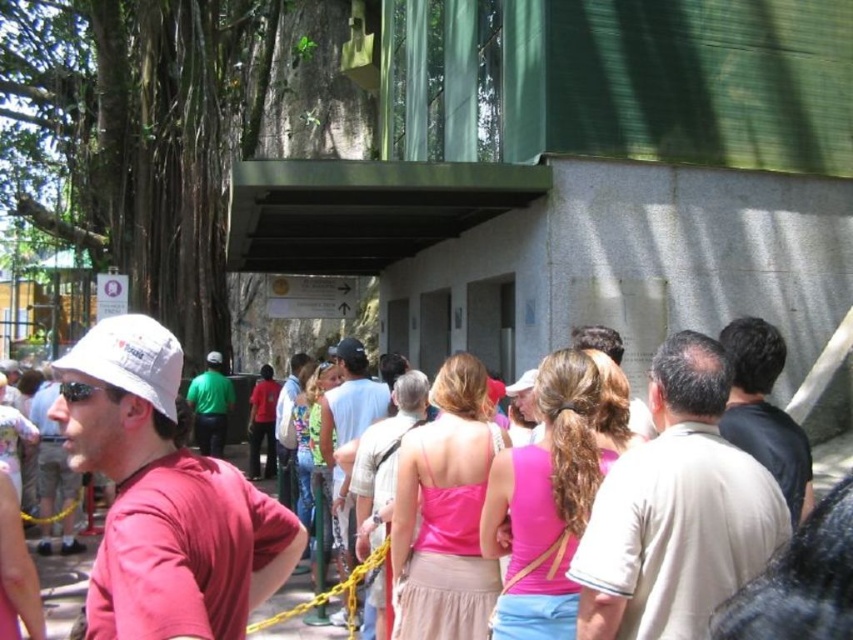
Locate an element on the screen. Image resolution: width=853 pixels, height=640 pixels. white matte baseball hat at left is located at coordinates (131, 356).

Between white matte baseball hat at left and matte pink tank top at center, which one is positioned higher?

matte pink tank top at center is higher up.

Does point (140, 378) come behind point (616, 340)?

No, it is in front of (616, 340).

Where is `white matte baseball hat at left`? white matte baseball hat at left is located at coordinates (131, 356).

Is dark gray shirt at center positioned at the back of green fabric shirt at center?

No, dark gray shirt at center is closer to the viewer.

Which is more to the right, dark gray shirt at center or green fabric shirt at center?

dark gray shirt at center

The width and height of the screenshot is (853, 640). What do you see at coordinates (764, 410) in the screenshot?
I see `dark gray shirt at center` at bounding box center [764, 410].

Where is `dark gray shirt at center`? The image size is (853, 640). dark gray shirt at center is located at coordinates (764, 410).

Which of these two, white matte baseball hat at left or black matte baseball hat at center, stands taller?

white matte baseball hat at left

Is white matte baseball hat at left above black matte baseball hat at center?

No, white matte baseball hat at left is not above black matte baseball hat at center.

The width and height of the screenshot is (853, 640). I want to click on white matte baseball hat at left, so click(131, 356).